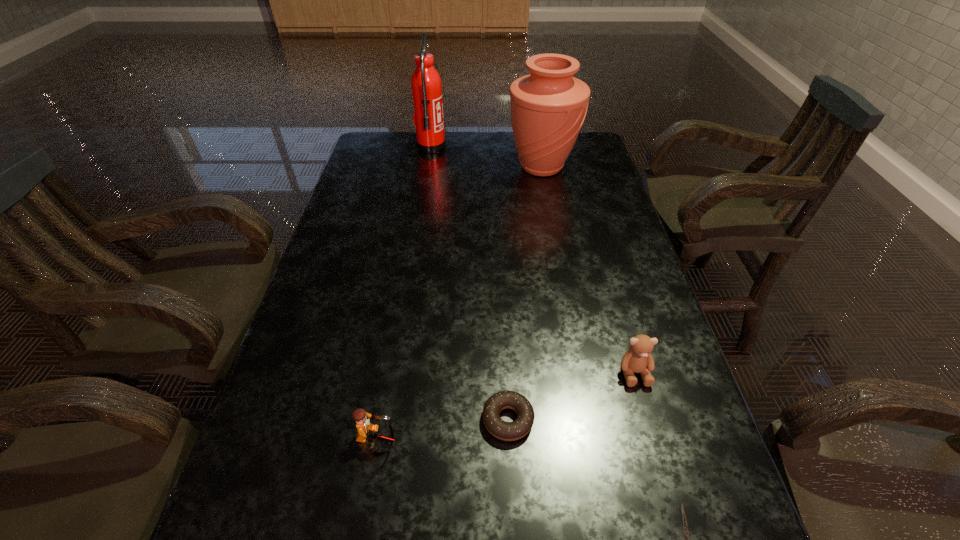
Locate an element on the screen. This screenshot has height=540, width=960. fire extinguisher is located at coordinates (426, 86).

The image size is (960, 540). I want to click on vase, so 548,107.

Identify the location of the third farthest object. The width and height of the screenshot is (960, 540). (638, 359).

The height and width of the screenshot is (540, 960). I want to click on Lego, so click(x=366, y=431).

Locate an element on the screen. Image resolution: width=960 pixels, height=540 pixels. the fifth tallest object is located at coordinates (507, 431).

Identify the location of vacant position located 0.170m on the label side of the fire extinguisher. (492, 147).

The width and height of the screenshot is (960, 540). I want to click on vacant area situated 0.270m on the front of the vase, so click(555, 240).

Identify the location of vacant space situated 0.270m on the face of the teddy bear. (681, 535).

Locate an element on the screen. Image resolution: width=960 pixels, height=540 pixels. vacant space positioned holding a crossbow in the hands of the Lego is located at coordinates (423, 440).

Locate an element on the screen. free space located 0.190m on the left of the doughnut is located at coordinates (385, 420).